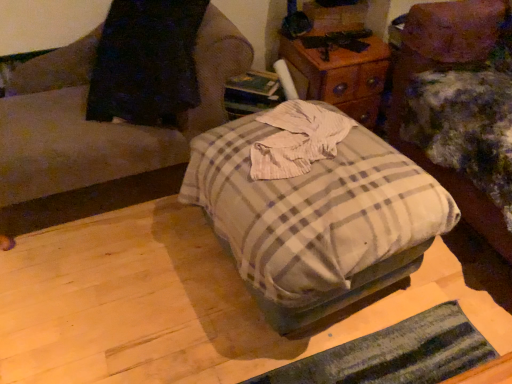
This screenshot has height=384, width=512. What are the coordinates of `free space in front of plaid fabric ottoman at center, which is the 1th furniture in left-to-right order` in the screenshot? It's located at (117, 295).